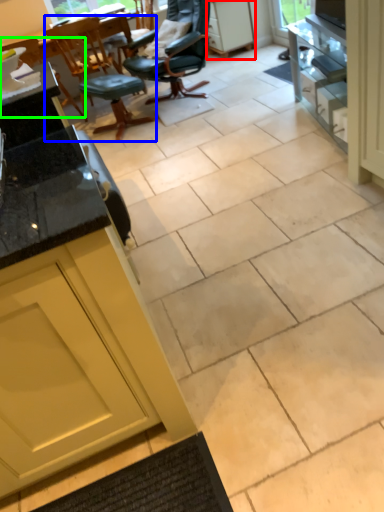
Question: Which is nearer to the cabinetry (highlighted by a red box)? chair (highlighted by a blue box) or chair (highlighted by a green box).

Choices:
 (A) chair
 (B) chair

Answer: (A)